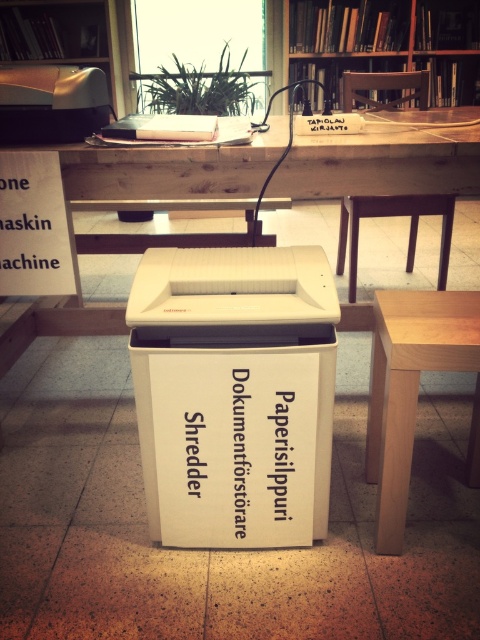
Question: Which object is closer to the camera taking this photo?

Choices:
 (A) wooden bookshelf at upper center
 (B) light brown wooden table at center

Answer: (B)

Question: Does light brown wooden table at center appear on the right side of wooden bookshelf at upper center?

Choices:
 (A) no
 (B) yes

Answer: (A)

Question: Can you confirm if light brown wooden table at center is positioned below wooden bookshelf at upper center?

Choices:
 (A) no
 (B) yes

Answer: (B)

Question: Does white plastic table at center appear under wooden bookshelf at upper center?

Choices:
 (A) yes
 (B) no

Answer: (A)

Question: Which of these objects is positioned farthest from the light brown wooden table at center?

Choices:
 (A) white plastic table at center
 (B) wooden bookshelf at upper center

Answer: (B)

Question: Which of the following is the farthest from the observer?

Choices:
 (A) light brown wooden table at center
 (B) wooden bookshelf at upper center

Answer: (B)